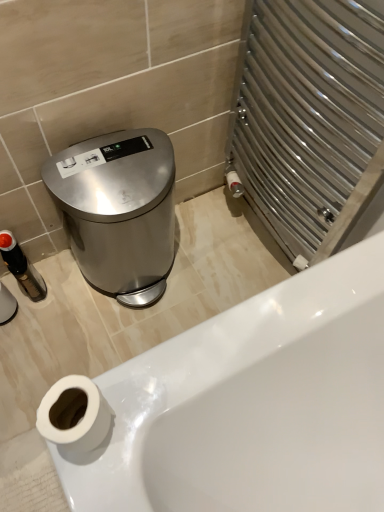
Question: From a real-world perspective, is white matte toilet paper at lower left physically located above or below white glossy bathtub at lower left?

Choices:
 (A) above
 (B) below

Answer: (A)

Question: Considering the positions of white matte toilet paper at lower left and white glossy bathtub at lower left in the image, is white matte toilet paper at lower left taller or shorter than white glossy bathtub at lower left?

Choices:
 (A) short
 (B) tall

Answer: (B)

Question: Considering the real-world distances, which object is closest to the white glossy bathtub at lower left?

Choices:
 (A) white matte toilet paper at lower left
 (B) polished stainless steel trash can at left

Answer: (A)

Question: Which of these objects is positioned closest to the white matte toilet paper at lower left?

Choices:
 (A) white glossy bathtub at lower left
 (B) polished stainless steel trash can at left

Answer: (A)